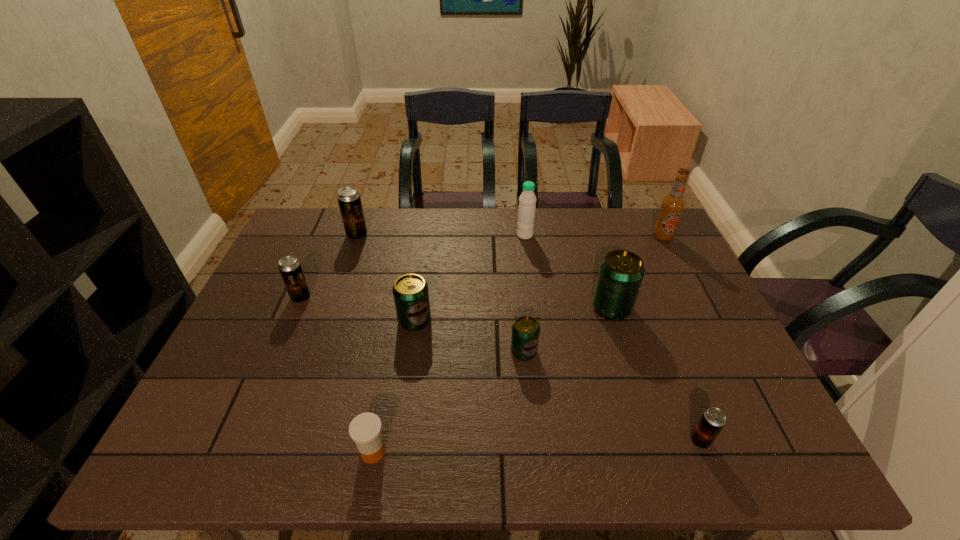
The image size is (960, 540). What are the coordinates of `the tallest object` in the screenshot? It's located at (672, 206).

The height and width of the screenshot is (540, 960). In order to click on the rightmost object in this screenshot , I will do `click(672, 206)`.

Locate an element on the screen. water bottle is located at coordinates (527, 201).

Image resolution: width=960 pixels, height=540 pixels. Identify the location of the second beer can from left to right. (349, 200).

You are a GUI agent. You are given a task and a screenshot of the screen. Output one action in this format:
    pyautogui.click(x=<x>, y=<y>)
    Task: Click on the second black beer can from right to left
    The height and width of the screenshot is (540, 960).
    Given the screenshot: What is the action you would take?
    pyautogui.click(x=349, y=200)

Where is `the rightmost green beer can`? the rightmost green beer can is located at coordinates pos(621,272).

Where is `the biggest green beer can`? The image size is (960, 540). the biggest green beer can is located at coordinates (621, 272).

Locate an element on the screen. The width and height of the screenshot is (960, 540). the leftmost object is located at coordinates (290, 268).

You are a GUI agent. You are given a task and a screenshot of the screen. Output one action in this format:
    pyautogui.click(x=<x>, y=<y>)
    Task: Click on the second biggest black beer can
    The height and width of the screenshot is (540, 960).
    Given the screenshot: What is the action you would take?
    pyautogui.click(x=290, y=268)

The height and width of the screenshot is (540, 960). I want to click on the leftmost green beer can, so click(x=411, y=296).